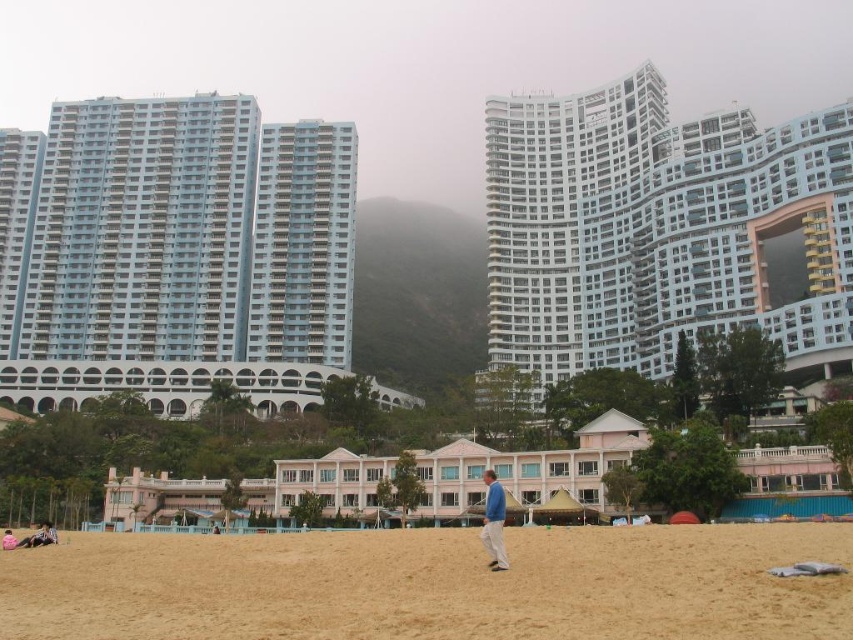
You are standing at the center of the beach scene and want to take a photo of the white glass building at upper right. Based on its position, in which direction should you point your camera to capture it?

The white glass building at upper right is located at point coordinates of 0.356 on the x axis and 0.770 on the y axis. Since the x value is less than 0.5, it means the building is positioned to the left side of the frame. The y value of 0.770 indicates it is near the top of the image. Therefore, to capture the white glass building at upper right, you should point your camera towards the upper left direction.

You are a photographer standing at the beach and want to take a photo that includes both the white glass building at upper right and the matte black surfboard at lower left. Based on their positions, which object should you adjust your camera angle to focus on first to ensure both are in the frame?

The white glass building at upper right is located above the matte black surfboard at lower left, so you should adjust your camera angle to focus on the white glass building at upper right first to ensure both are in the frame.